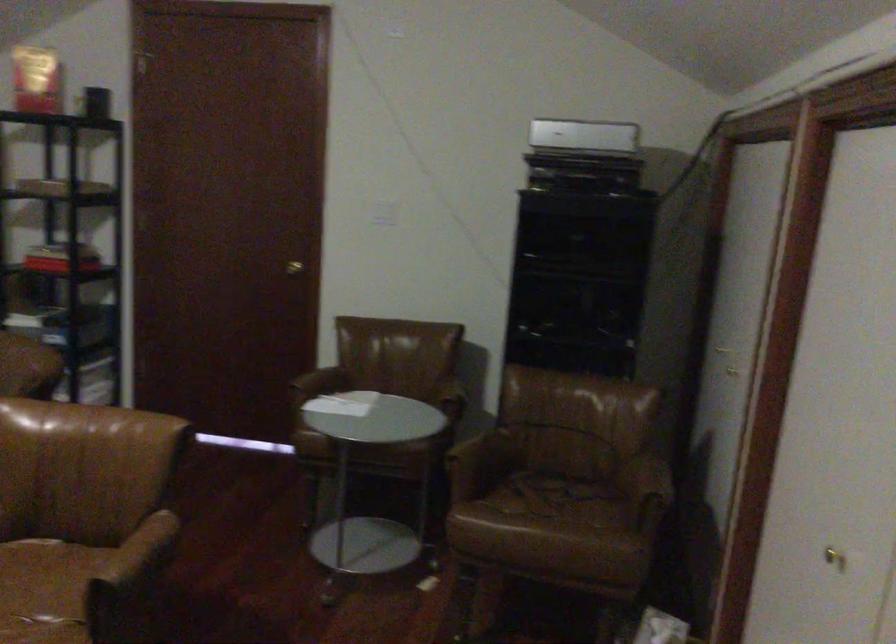
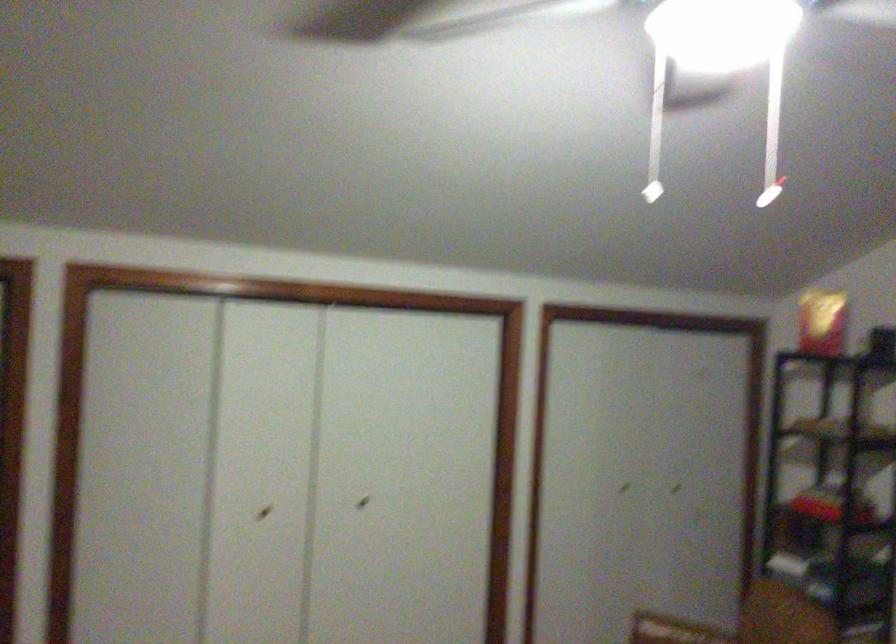
Question: The camera is either moving clockwise (left) or counter-clockwise (right) around the object. The first image is from the beginning of the video and the second image is from the end. Is the camera moving left or right when shooting the video?

Choices:
 (A) Left
 (B) Right

Answer: (B)